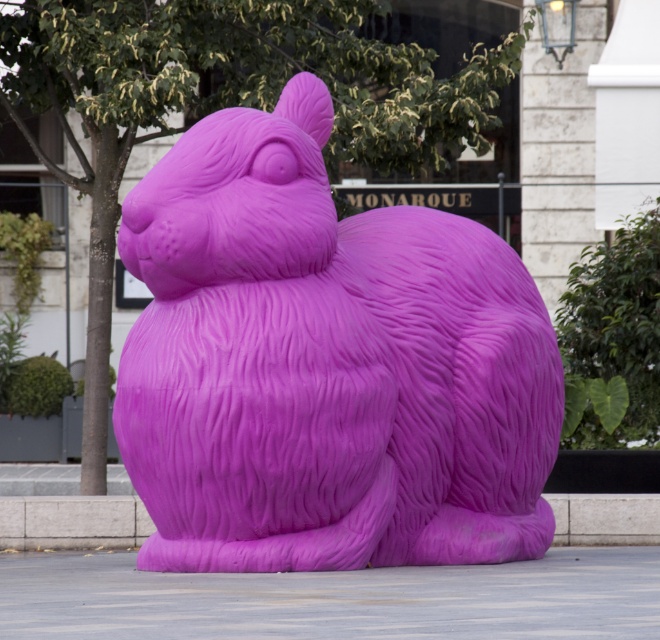
You are standing in front of the MONARQUE building and see the point marked at coordinates (x=325, y=365). Based on the scene description, can you determine which object this point is located on?

The point at coordinates (x=325, y=365) is located on the matte purple rabbit at center.

You are a delivery person with a cart that is 2 meters wide. You need to move from the matte purple rabbit at center to the purple rubber curb at lower center. Is there enough space for your cart to pass through the path between them?

The distance between the matte purple rabbit at center and the purple rubber curb at lower center is 6.59 meters. Since the cart is only 2 meters wide, there is sufficient space for the cart to pass through the path between them.

You are a delivery person who needs to park your delivery van on the gray concrete pavement at center. The van is 2 meters wide. Can the matte purple rabbit at center help you determine if the pavement is wide enough?

The matte purple rabbit at center has a lesser width compared to gray concrete pavement at center, so the pavement is wider than 2 meters. Therefore, the van can park on the gray concrete pavement at center.